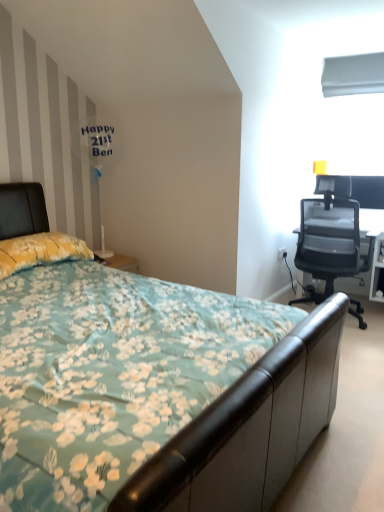
Question: Is transparent mesh office chair at right to the right of floral fabric bed at center from the viewer's perspective?

Choices:
 (A) yes
 (B) no

Answer: (A)

Question: Is transparent mesh office chair at right shorter than floral fabric bed at center?

Choices:
 (A) no
 (B) yes

Answer: (A)

Question: Is transparent mesh office chair at right located outside floral fabric bed at center?

Choices:
 (A) yes
 (B) no

Answer: (A)

Question: From the image's perspective, is transparent mesh office chair at right under floral fabric bed at center?

Choices:
 (A) no
 (B) yes

Answer: (A)

Question: Is transparent mesh office chair at right far from floral fabric bed at center?

Choices:
 (A) yes
 (B) no

Answer: (A)

Question: From a real-world perspective, is yellow floral fabric pillow at left above or below white plastic power outlet at right?

Choices:
 (A) above
 (B) below

Answer: (A)

Question: Looking at their shapes, would you say yellow floral fabric pillow at left is wider or thinner than white plastic power outlet at right?

Choices:
 (A) thin
 (B) wide

Answer: (B)

Question: Is yellow floral fabric pillow at left to the left or to the right of white plastic power outlet at right in the image?

Choices:
 (A) left
 (B) right

Answer: (A)

Question: Does point (6, 248) appear closer or farther from the camera than point (286, 251)?

Choices:
 (A) farther
 (B) closer

Answer: (B)

Question: Based on their positions, is white plastic power outlet at right located to the left or right of floral fabric bed at center?

Choices:
 (A) left
 (B) right

Answer: (B)

Question: Is white plastic power outlet at right in front of or behind floral fabric bed at center in the image?

Choices:
 (A) front
 (B) behind

Answer: (B)

Question: Is white plastic power outlet at right situated inside floral fabric bed at center or outside?

Choices:
 (A) outside
 (B) inside

Answer: (A)

Question: From a real-world perspective, is white plastic power outlet at right positioned above or below floral fabric bed at center?

Choices:
 (A) below
 (B) above

Answer: (A)

Question: Is point pyautogui.click(x=6, y=261) positioned closer to the camera than point pyautogui.click(x=100, y=151)?

Choices:
 (A) closer
 (B) farther

Answer: (A)

Question: Looking at their shapes, would you say yellow floral fabric pillow at left is wider or thinner than white glossy table lamp at upper left?

Choices:
 (A) thin
 (B) wide

Answer: (B)